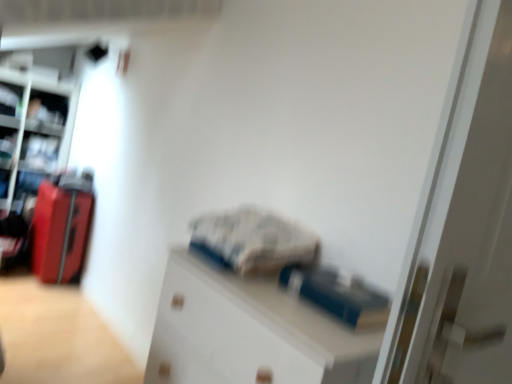
Question: Considering the relative sizes of matte red suitcase at left and metallic silver bookshelf at left in the image provided, is matte red suitcase at left taller than metallic silver bookshelf at left?

Choices:
 (A) no
 (B) yes

Answer: (A)

Question: Can metallic silver bookshelf at left be found inside matte red suitcase at left?

Choices:
 (A) no
 (B) yes

Answer: (A)

Question: From a real-world perspective, is matte red suitcase at left on top of metallic silver bookshelf at left?

Choices:
 (A) no
 (B) yes

Answer: (A)

Question: Considering the relative positions of matte red suitcase at left and metallic silver bookshelf at left in the image provided, is matte red suitcase at left to the left of metallic silver bookshelf at left from the viewer's perspective?

Choices:
 (A) no
 (B) yes

Answer: (A)

Question: Does matte red suitcase at left have a smaller size compared to metallic silver bookshelf at left?

Choices:
 (A) no
 (B) yes

Answer: (B)

Question: Does matte red suitcase at left come behind metallic silver bookshelf at left?

Choices:
 (A) yes
 (B) no

Answer: (B)

Question: Is white glossy door at center a part of matte red suitcase at left?

Choices:
 (A) yes
 (B) no

Answer: (B)

Question: Can you confirm if matte red suitcase at left is smaller than white glossy door at center?

Choices:
 (A) yes
 (B) no

Answer: (A)

Question: Is matte red suitcase at left at the right side of white glossy door at center?

Choices:
 (A) yes
 (B) no

Answer: (B)

Question: Does matte red suitcase at left have a lesser width compared to white glossy door at center?

Choices:
 (A) no
 (B) yes

Answer: (A)

Question: From the image's perspective, is matte red suitcase at left on white glossy door at center?

Choices:
 (A) no
 (B) yes

Answer: (A)

Question: Is matte red suitcase at left beside white glossy door at center?

Choices:
 (A) no
 (B) yes

Answer: (A)

Question: Considering the relative sizes of white glossy door at center and matte black shelf at upper left in the image provided, is white glossy door at center wider than matte black shelf at upper left?

Choices:
 (A) yes
 (B) no

Answer: (B)